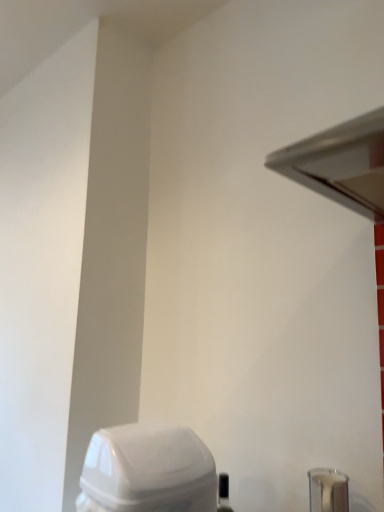
Image resolution: width=384 pixels, height=512 pixels. Find the location of `satin nickel faucet at lower right`. satin nickel faucet at lower right is located at coordinates (328, 490).

This screenshot has height=512, width=384. What do you see at coordinates (328, 490) in the screenshot? I see `satin nickel faucet at lower right` at bounding box center [328, 490].

Identify the location of satin nickel faucet at lower right. Image resolution: width=384 pixels, height=512 pixels. (328, 490).